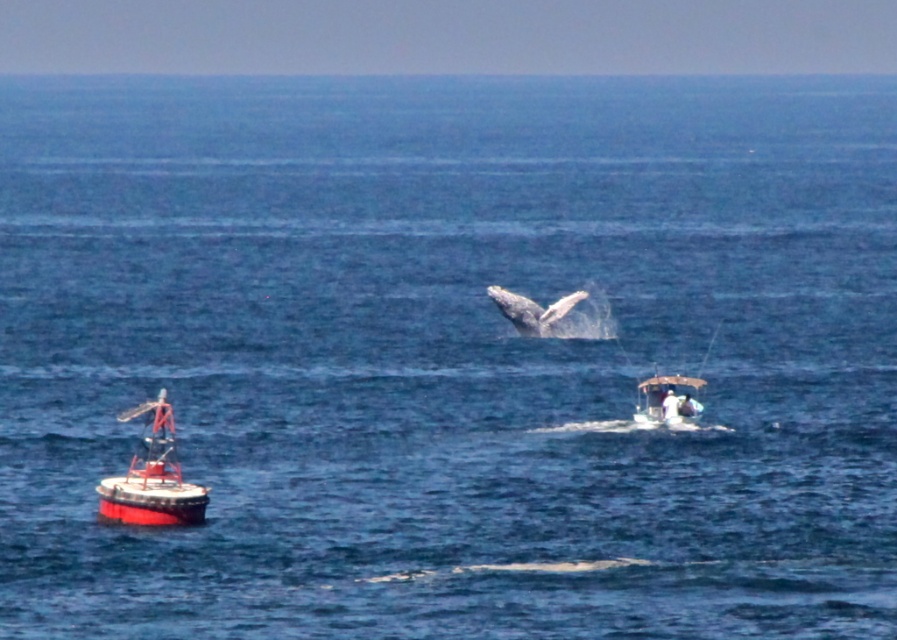
Is wooden boat at center taller than gray matte whale at center?

No, wooden boat at center is not taller than gray matte whale at center.

Does wooden boat at center come in front of gray matte whale at center?

Yes, it is in front of gray matte whale at center.

Is point (669, 387) farther from viewer compared to point (523, 304)?

No, it is not.

Where is `wooden boat at center`? Image resolution: width=897 pixels, height=640 pixels. wooden boat at center is located at coordinates (668, 400).

In the scene shown: Is red painted buoy at left positioned behind wooden boat at center?

No, it is in front of wooden boat at center.

Is red painted buoy at left wider than wooden boat at center?

In fact, red painted buoy at left might be narrower than wooden boat at center.

Image resolution: width=897 pixels, height=640 pixels. In order to click on red painted buoy at left in this screenshot , I will do `click(152, 477)`.

In the scene shown: Who is more forward, (112, 516) or (495, 289)?

Positioned in front is point (112, 516).

You are a GUI agent. You are given a task and a screenshot of the screen. Output one action in this format:
    pyautogui.click(x=<x>, y=<y>)
    Task: Click on the red painted buoy at left
    
    Given the screenshot: What is the action you would take?
    pyautogui.click(x=152, y=477)